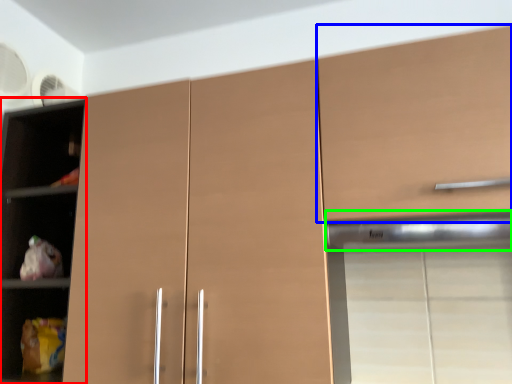
Question: Which is nearer to the cupboard (highlighted by a red box)? cabinetry (highlighted by a blue box) or exhaust hood (highlighted by a green box).

Choices:
 (A) cabinetry
 (B) exhaust hood

Answer: (A)